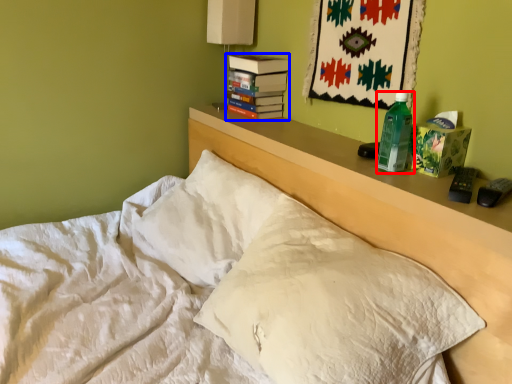
Question: Which of the following is the farthest to the observer, bottle (highlighted by a red box) or paperback book (highlighted by a blue box)?

Choices:
 (A) bottle
 (B) paperback book

Answer: (B)